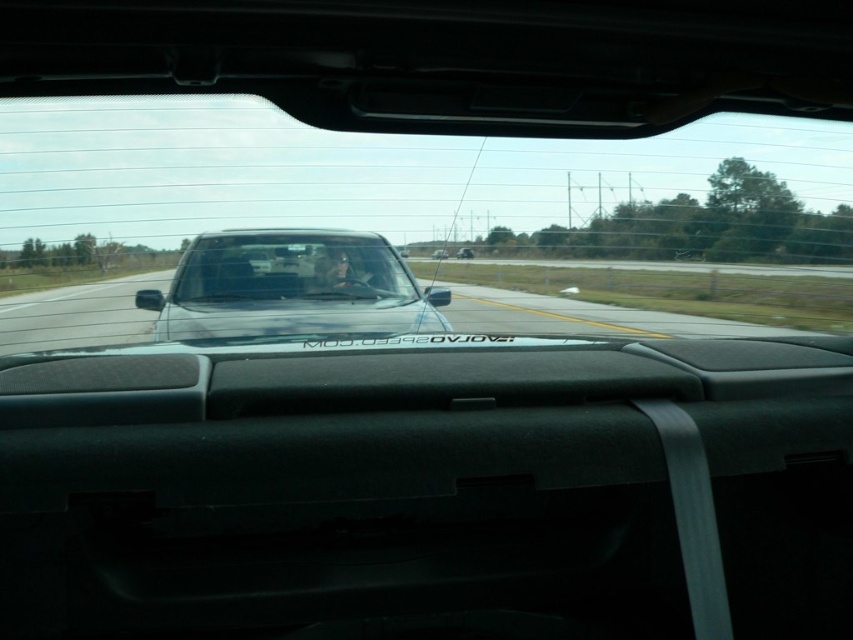
Is the position of transparent glass car window at center less distant than that of clear glass windshield at center?

Yes, transparent glass car window at center is in front of clear glass windshield at center.

Can you confirm if transparent glass car window at center is thinner than clear glass windshield at center?

No.

Which is behind, point (749, 152) or point (332, 253)?

Point (749, 152)

Where is `transparent glass car window at center`? The width and height of the screenshot is (853, 640). transparent glass car window at center is located at coordinates 412,225.

How distant is black glossy car at center from clear glass windshield at center?

black glossy car at center and clear glass windshield at center are 8.44 meters apart from each other.

Can you confirm if black glossy car at center is positioned to the right of clear glass windshield at center?

Indeed, black glossy car at center is positioned on the right side of clear glass windshield at center.

This screenshot has width=853, height=640. What do you see at coordinates (640, 304) in the screenshot?
I see `black glossy car at center` at bounding box center [640, 304].

Locate an element on the screen. Image resolution: width=853 pixels, height=640 pixels. black glossy car at center is located at coordinates (640, 304).

Based on the photo, does transparent glass car window at center appear on the right side of satin black truck at center?

Incorrect, transparent glass car window at center is not on the right side of satin black truck at center.

From the picture: Who is more forward, (384, 154) or (358, 305)?

Positioned in front is point (358, 305).

What do you see at coordinates (412, 225) in the screenshot? I see `transparent glass car window at center` at bounding box center [412, 225].

The height and width of the screenshot is (640, 853). What are the coordinates of `transparent glass car window at center` in the screenshot? It's located at (412, 225).